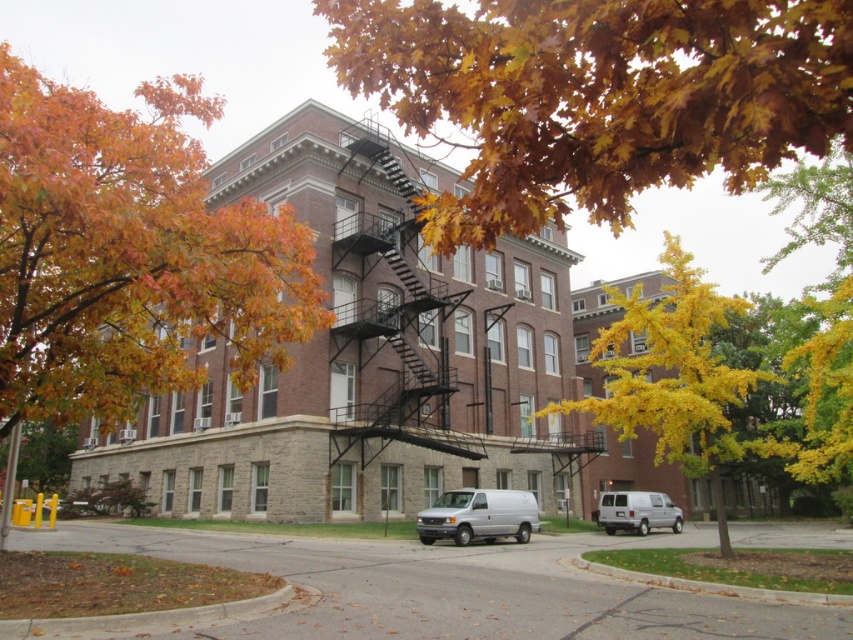
You are a delivery person trying to park your van, which is the same width as the white matte van at lower right, in a spot near the black metal fire escape at center. Will your van fit without blocking the fire escape?

The black metal fire escape at center is wider than the white matte van at lower right, so your van, being the same width as the white matte van at lower right, will fit without blocking the fire escape as there is enough space.